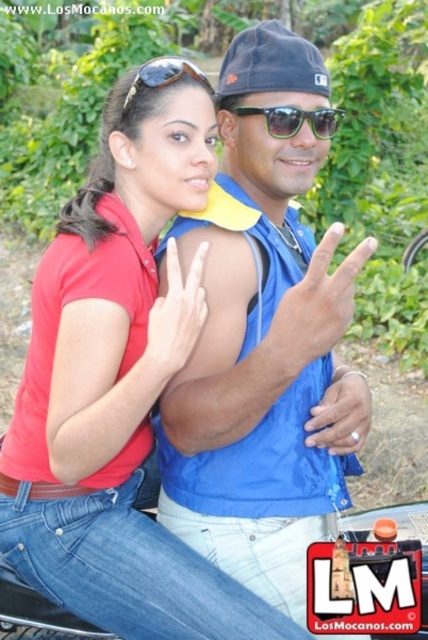
You are a photographer trying to capture a closeup of the blue fabric vest at center and the sunglasses at center. Which object should you zoom in on to ensure both are in focus without moving the camera?

The blue fabric vest at center is wider than sunglasses at center, so you should zoom in on the blue fabric vest at center to ensure both are in focus.

You are a photographer trying to focus on the matte red polo shirt at center and the matte black sunglasses at upper center in the image. Which object should you zoom in on to capture more details without moving the camera?

The matte red polo shirt at center has a larger size compared to the matte black sunglasses at upper center, so zooming in on the matte red polo shirt at center would allow you to capture more details without moving the camera because it is bigger and occupies more space in the frame.